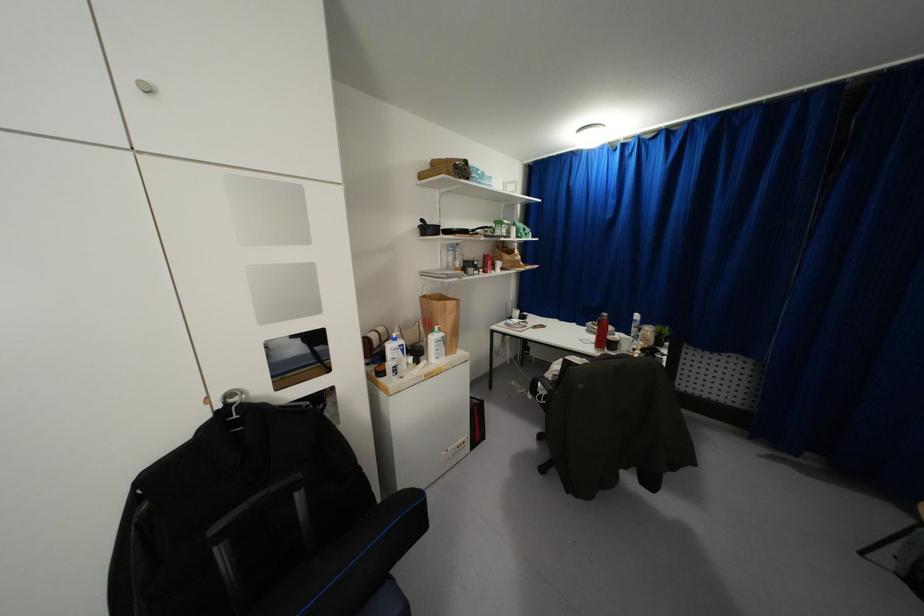
Where would you lift the brown paper bag? Please return your answer as a coordinate pair (x, y).

(441, 317)